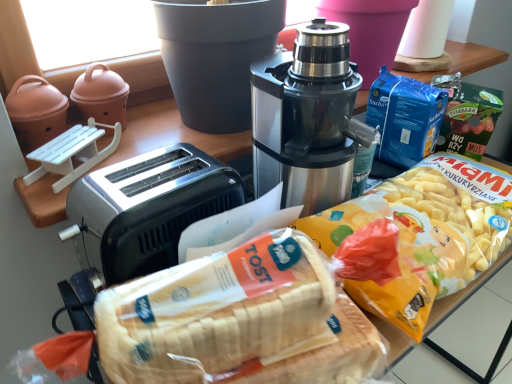
What are the coordinates of `free space above satin silver toaster at left (from a real-world perspective)` in the screenshot? It's located at (160, 179).